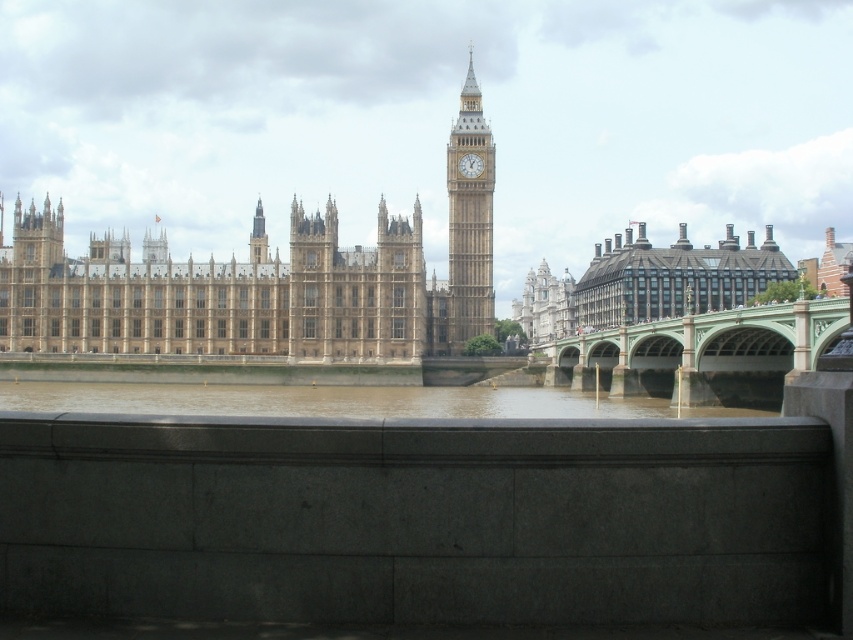
You are a tourist standing on the walkway near the green stone bridge at center and the golden stone clock tower at center. Which object is positioned lower in the image?

The green stone bridge at center is positioned below the golden stone clock tower at center, so it is lower in the image.